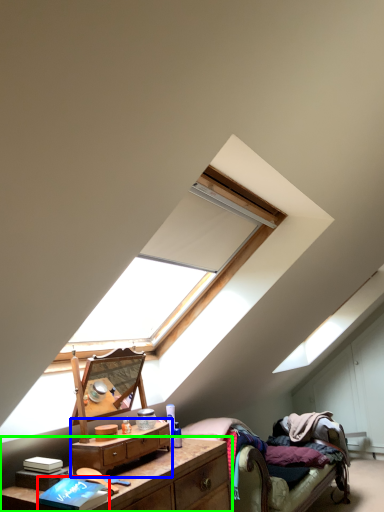
Question: Estimate the real-world distances between objects in this image. Which object is farther from book (highlighted by a red box), nightstand (highlighted by a blue box) or nightstand (highlighted by a green box)?

Choices:
 (A) nightstand
 (B) nightstand

Answer: (B)